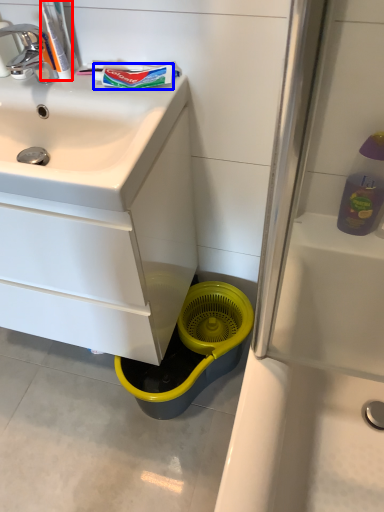
Question: Which object is closer to the camera taking this photo, toothpaste (highlighted by a red box) or toothpaste (highlighted by a blue box)?

Choices:
 (A) toothpaste
 (B) toothpaste

Answer: (A)